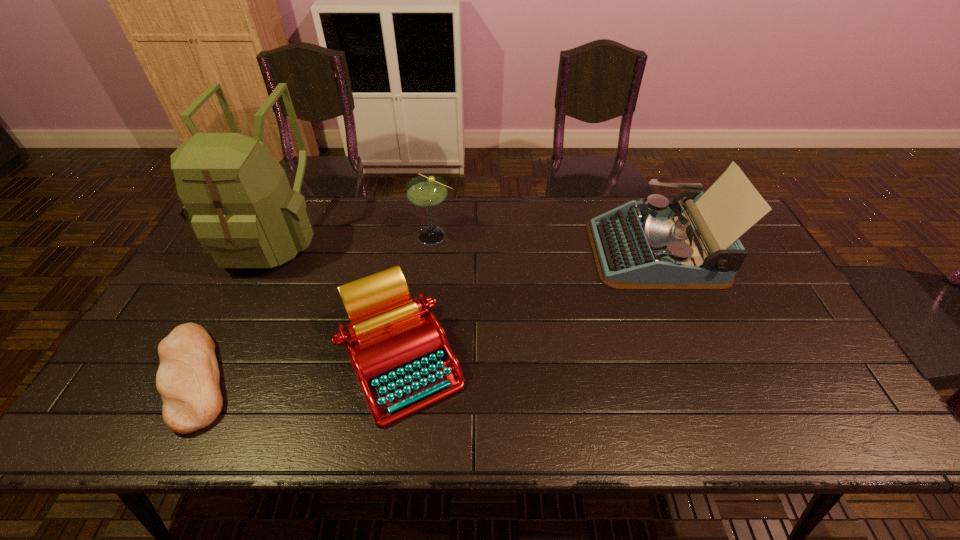
Locate an element on the screen. This screenshot has height=540, width=960. the tallest object is located at coordinates (237, 199).

Identify the location of the taller typewriter. (655, 245).

You are a GUI agent. You are given a task and a screenshot of the screen. Output one action in this format:
    pyautogui.click(x=<x>, y=<y>)
    Task: Click on the farther typewriter
    The width and height of the screenshot is (960, 540).
    Given the screenshot: What is the action you would take?
    pyautogui.click(x=655, y=245)

The height and width of the screenshot is (540, 960). Find the location of `martini`. martini is located at coordinates pyautogui.click(x=425, y=191).

Identify the location of the fourth tallest object. The image size is (960, 540). (398, 349).

Locate an element on the screen. This screenshot has width=960, height=540. the left typewriter is located at coordinates (398, 349).

Identify the location of bread. This screenshot has height=540, width=960. (188, 377).

Locate an element on the screen. vacant space located 0.320m on the front pocket of the backpack is located at coordinates (203, 377).

At what (x,y) coordinates should I click in order to perform the action: click on free space located 0.190m on the typing side of the right typewriter. Please return your answer as a coordinate pair (x, y). This screenshot has width=960, height=540. Looking at the image, I should click on (531, 251).

You are a GUI agent. You are given a task and a screenshot of the screen. Output one action in this format:
    pyautogui.click(x=<x>, y=<y>)
    Task: Click on the vacant region located 0.120m on the typing side of the right typewriter
    Image resolution: width=960 pixels, height=540 pixels.
    Given the screenshot: What is the action you would take?
    pyautogui.click(x=554, y=251)